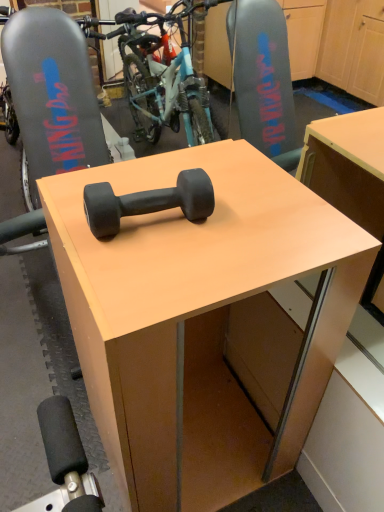
Question: Is matte black dumbbell at center outside black rubber dumbbell at center?

Choices:
 (A) yes
 (B) no

Answer: (A)

Question: Can you confirm if matte black dumbbell at center is smaller than black rubber dumbbell at center?

Choices:
 (A) yes
 (B) no

Answer: (B)

Question: Can you confirm if matte black dumbbell at center is positioned to the left of black rubber dumbbell at center?

Choices:
 (A) no
 (B) yes

Answer: (A)

Question: Would you consider matte black dumbbell at center to be distant from black rubber dumbbell at center?

Choices:
 (A) no
 (B) yes

Answer: (A)

Question: From the image's perspective, is matte black dumbbell at center on top of black rubber dumbbell at center?

Choices:
 (A) no
 (B) yes

Answer: (A)

Question: Does matte black dumbbell at center touch black rubber dumbbell at center?

Choices:
 (A) no
 (B) yes

Answer: (A)

Question: Considering the relative sizes of black rubber dumbbell at center and matte black dumbbell at center in the image provided, is black rubber dumbbell at center bigger than matte black dumbbell at center?

Choices:
 (A) no
 (B) yes

Answer: (A)

Question: Could you tell me if black rubber dumbbell at center is facing matte black dumbbell at center?

Choices:
 (A) yes
 (B) no

Answer: (B)

Question: Can you confirm if black rubber dumbbell at center is thinner than matte black dumbbell at center?

Choices:
 (A) yes
 (B) no

Answer: (A)

Question: Could matte black dumbbell at center be considered to be inside black rubber dumbbell at center?

Choices:
 (A) yes
 (B) no

Answer: (B)

Question: Considering the relative sizes of black rubber dumbbell at center and matte black dumbbell at center in the image provided, is black rubber dumbbell at center smaller than matte black dumbbell at center?

Choices:
 (A) no
 (B) yes

Answer: (B)

Question: From the image's perspective, is black rubber dumbbell at center located beneath matte black dumbbell at center?

Choices:
 (A) yes
 (B) no

Answer: (B)

Question: In terms of width, does black rubber dumbbell at center look wider or thinner when compared to matte black dumbbell at center?

Choices:
 (A) wide
 (B) thin

Answer: (B)